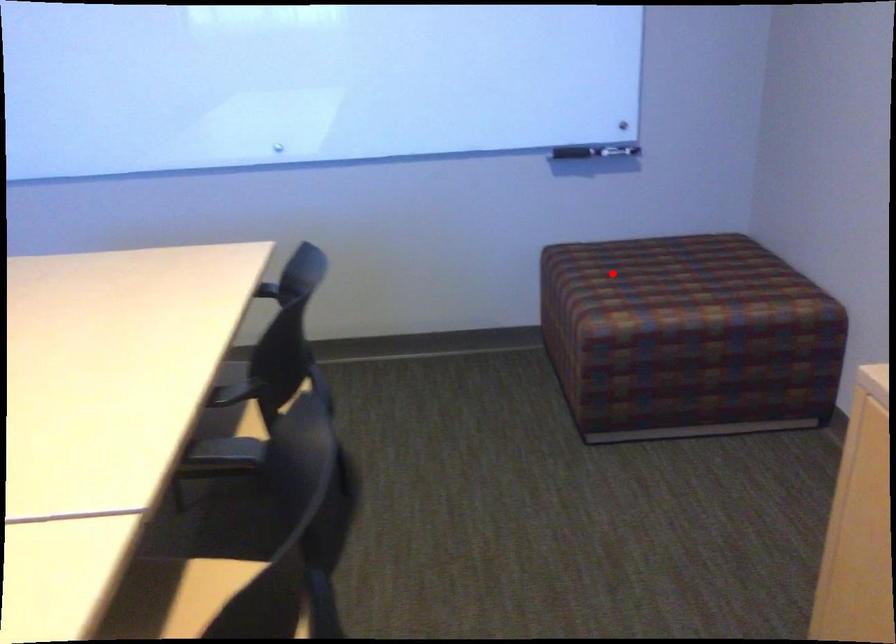
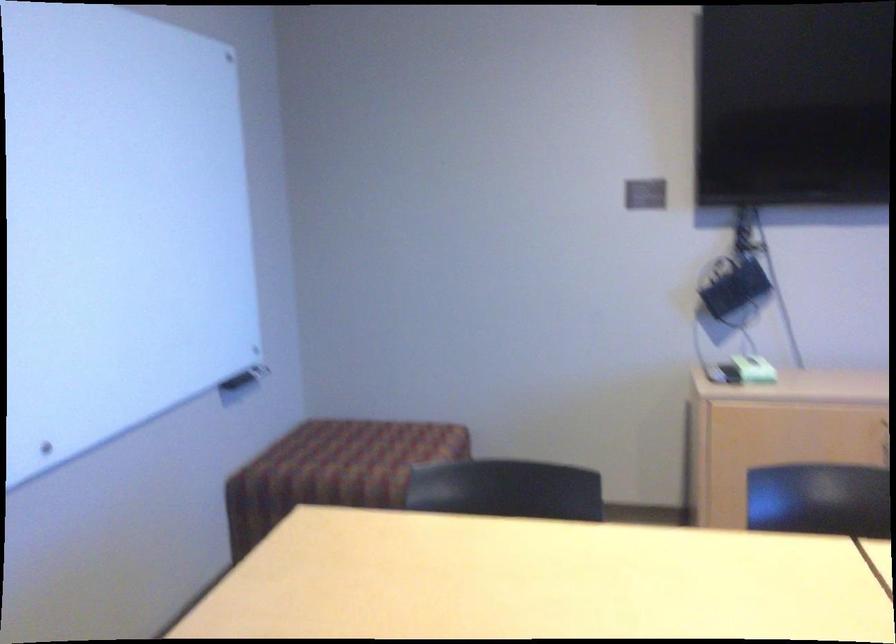
Question: I am providing you with two images of the same scene from different viewpoints. Given a red point in image1, look at the same physical point in image2. Is it:

Choices:
 (A) Closer to the viewpoint
 (B) Farther from the viewpoint

Answer: (B)